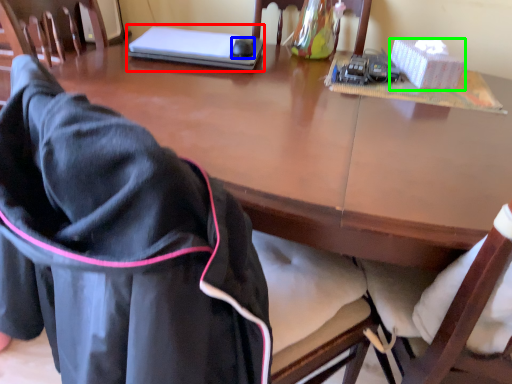
Question: Estimate the real-world distances between objects in this image. Which object is farther from laptop (highlighted by a red box), mouse (highlighted by a blue box) or box (highlighted by a green box)?

Choices:
 (A) mouse
 (B) box

Answer: (B)